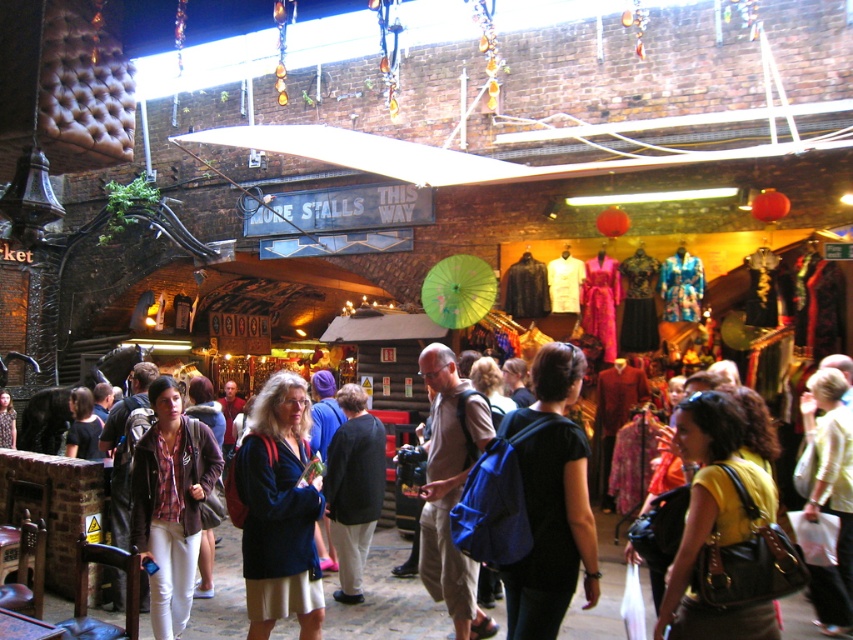
Does dark blue sweater at center have a larger size compared to matte black jacket at center?

No.

Where is `dark blue sweater at center`? The width and height of the screenshot is (853, 640). dark blue sweater at center is located at coordinates (279, 512).

The height and width of the screenshot is (640, 853). Identify the location of dark blue sweater at center. (279, 512).

Is yellow fabric bag at center below matte black jacket at center?

Yes.

Does yellow fabric bag at center have a smaller size compared to matte black jacket at center?

No.

From the picture: Who is more forward, (840, 600) or (74, 452)?

Point (840, 600) is more forward.

Find the location of a particular element. yellow fabric bag at center is located at coordinates (830, 493).

Is the position of plaid fabric shirt at center more distant than that of matte black jacket at center?

No, it is not.

Between plaid fabric shirt at center and matte black jacket at center, which one is positioned lower?

plaid fabric shirt at center

Identify the location of plaid fabric shirt at center. The height and width of the screenshot is (640, 853). (170, 502).

Where is `plaid fabric shirt at center`? plaid fabric shirt at center is located at coordinates (170, 502).